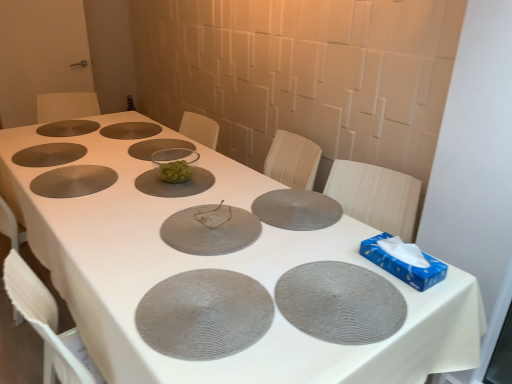
You are a GUI agent. You are given a task and a screenshot of the screen. Output one action in this format:
    pyautogui.click(x=<x>, y=<y>)
    Task: Click on the vacant area that lies between gray textured placemat at lower right, which ranks as the second glass plate in front-to-back order, and matte gray glass plate at center, placed as the third glass plate when sorted from front to back
    
    Given the screenshot: What is the action you would take?
    tap(274, 247)